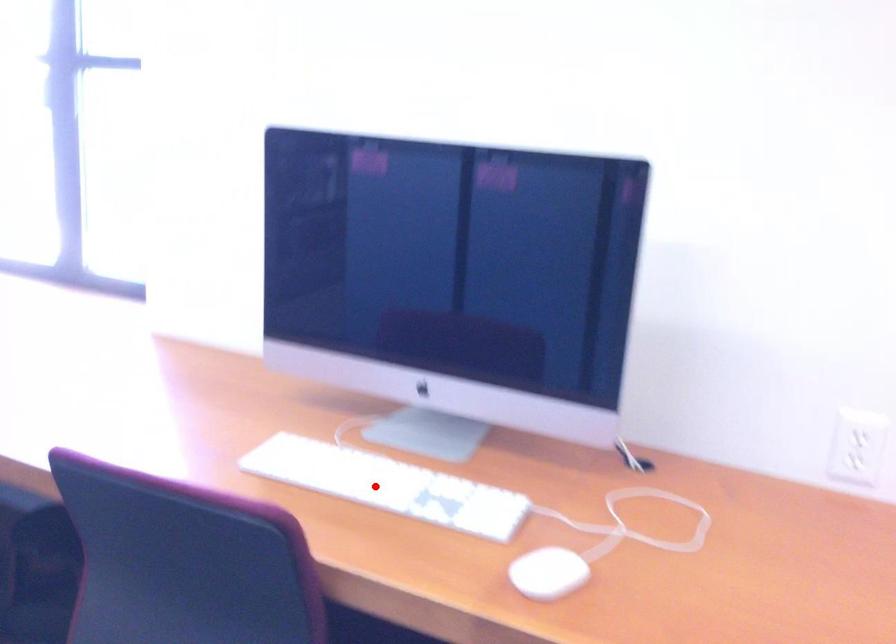
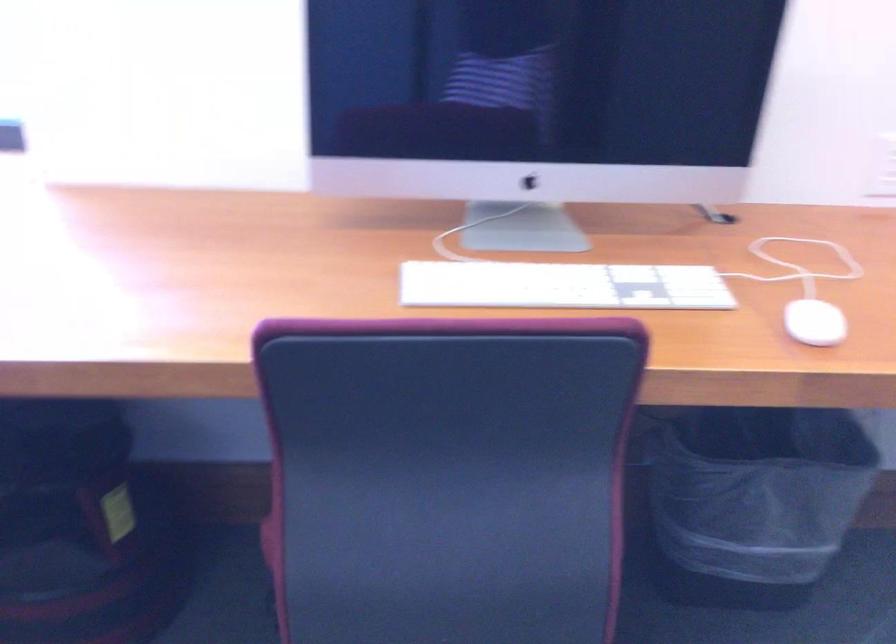
Question: A red point is marked in image1. In image2, is the corresponding 3D point closer to the camera or farther? Reply with the corresponding letter.

Choices:
 (A) The corresponding 3D point is closer.
 (B) The corresponding 3D point is farther.

Answer: (A)